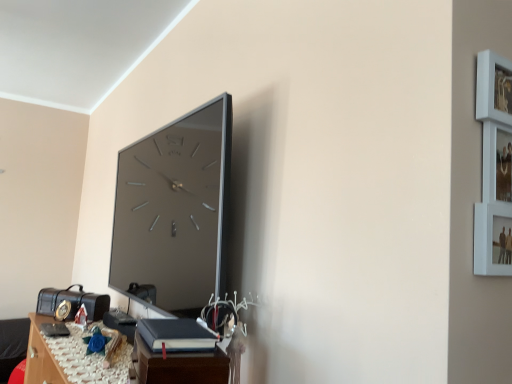
Question: From the image's perspective, is dark brown wood table at lower center, which is the 1th table from front to back, above wooden table at lower left, arranged as the second table when viewed from the right?

Choices:
 (A) no
 (B) yes

Answer: (B)

Question: From the image's perspective, is dark brown wood table at lower center, arranged as the 1th table when viewed from the right, located beneath wooden table at lower left, arranged as the first table when ordered from the bottom?

Choices:
 (A) yes
 (B) no

Answer: (B)

Question: Can you confirm if dark brown wood table at lower center, arranged as the 1th table when viewed from the right, is wider than wooden table at lower left, the first table in the back-to-front sequence?

Choices:
 (A) yes
 (B) no

Answer: (B)

Question: Does dark brown wood table at lower center, which is the 1th table from front to back, lie in front of wooden table at lower left, which is the second table from front to back?

Choices:
 (A) yes
 (B) no

Answer: (A)

Question: Is dark brown wood table at lower center, placed as the 2th table when sorted from bottom to top, bigger than wooden table at lower left, which is the second table from front to back?

Choices:
 (A) no
 (B) yes

Answer: (B)

Question: Considering the relative sizes of dark brown wood table at lower center, the 2th table when ordered from back to front, and wooden table at lower left, the first table in the back-to-front sequence, in the image provided, is dark brown wood table at lower center, the 2th table when ordered from back to front, smaller than wooden table at lower left, the first table in the back-to-front sequence,?

Choices:
 (A) no
 (B) yes

Answer: (A)

Question: From a real-world perspective, is dark brown wood table at lower center, which ranks as the first table in top-to-bottom order, on black leather book at lower center?

Choices:
 (A) no
 (B) yes

Answer: (A)

Question: Could black leather book at lower center be considered to be inside dark brown wood table at lower center, which ranks as the second table in left-to-right order?

Choices:
 (A) yes
 (B) no

Answer: (B)

Question: From the image's perspective, does dark brown wood table at lower center, arranged as the 1th table when viewed from the right, appear lower than black leather book at lower center?

Choices:
 (A) yes
 (B) no

Answer: (A)

Question: Is dark brown wood table at lower center, the 2th table when ordered from back to front, taller than black leather book at lower center?

Choices:
 (A) yes
 (B) no

Answer: (A)

Question: Is the position of dark brown wood table at lower center, which ranks as the first table in top-to-bottom order, less distant than that of black leather book at lower center?

Choices:
 (A) no
 (B) yes

Answer: (B)

Question: Is dark brown wood table at lower center, the 2th table when ordered from back to front, outside black leather book at lower center?

Choices:
 (A) yes
 (B) no

Answer: (A)

Question: Is wooden table at lower left, which is the second table from front to back, to the right of black leather book at lower center from the viewer's perspective?

Choices:
 (A) yes
 (B) no

Answer: (B)